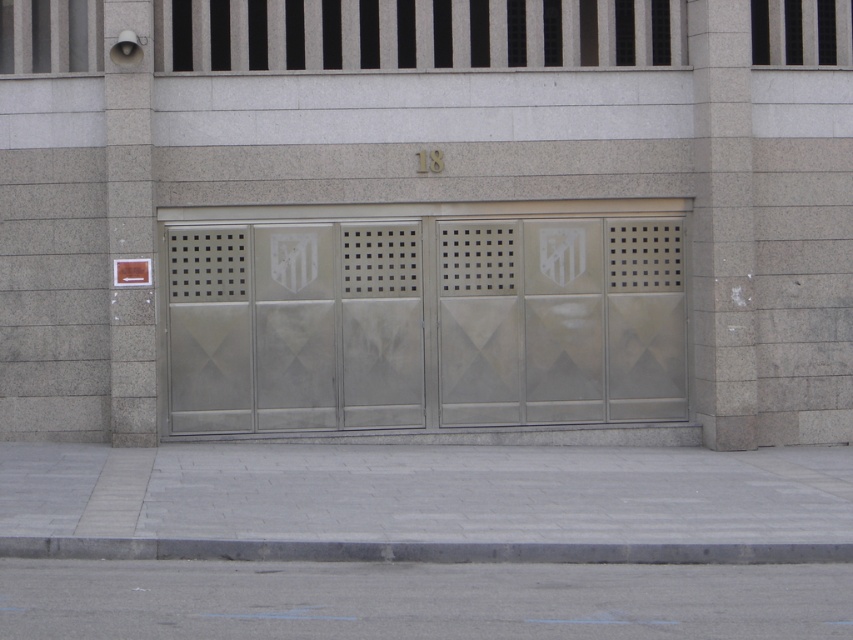
Question: Which of the following is the farthest from the observer?

Choices:
 (A) gray concrete pavement at lower center
 (B) gray concrete curb at lower center

Answer: (B)

Question: Does satin silver metal at center have a larger size compared to gray concrete pavement at lower center?

Choices:
 (A) no
 (B) yes

Answer: (B)

Question: From the image, what is the correct spatial relationship of satin silver metal at center in relation to gray concrete pavement at lower center?

Choices:
 (A) above
 (B) below

Answer: (A)

Question: Does satin silver metal at center appear on the right side of gray concrete pavement at lower center?

Choices:
 (A) no
 (B) yes

Answer: (A)

Question: Which object appears closest to the camera in this image?

Choices:
 (A) satin silver metal at center
 (B) gray concrete curb at lower center

Answer: (B)

Question: Which of the following is the closest to the observer?

Choices:
 (A) (467, 221)
 (B) (164, 544)
 (C) (498, 573)

Answer: (C)